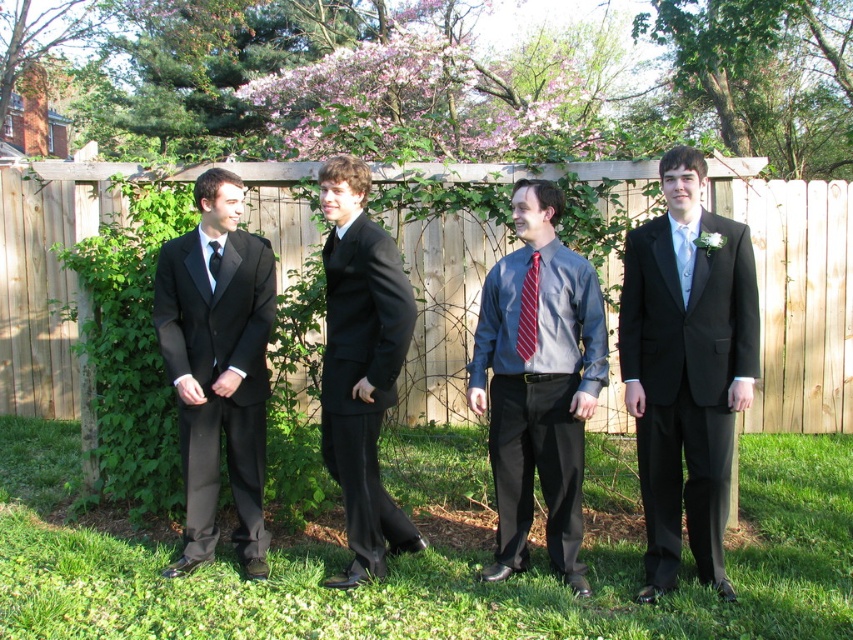
Question: Is matte black suit at left to the right of matte black tie at right from the viewer's perspective?

Choices:
 (A) no
 (B) yes

Answer: (A)

Question: Is wooden fence at center in front of matte black suit at right?

Choices:
 (A) yes
 (B) no

Answer: (B)

Question: Based on their relative distances, which object is farther from the matte black tie at right?

Choices:
 (A) matte black suit at left
 (B) matte black suit at right
 (C) matte black tie at left

Answer: (C)

Question: Which object appears closest to the camera in this image?

Choices:
 (A) red striped tie at center
 (B) matte black tie at left
 (C) matte black tie at right

Answer: (C)

Question: Is wooden fence at center positioned at the back of red striped tie at center?

Choices:
 (A) no
 (B) yes

Answer: (B)

Question: Which is nearer to the black satin suit at center?

Choices:
 (A) matte black suit at right
 (B) red striped tie at center
 (C) matte gray shirt at center

Answer: (C)